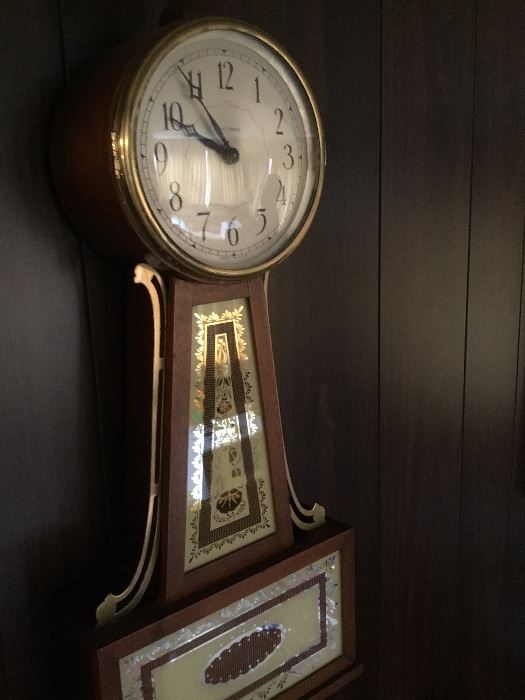
Where is `clock base`? Image resolution: width=525 pixels, height=700 pixels. clock base is located at coordinates (207, 662).